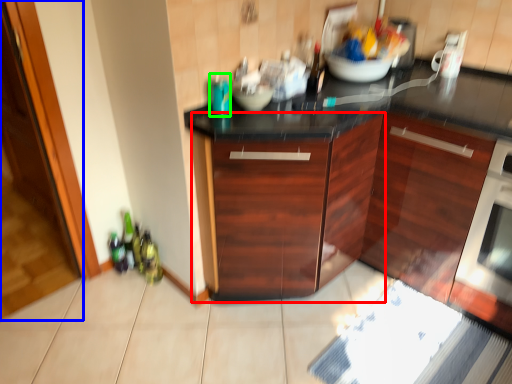
Question: Which object is the closest to the cabinetry (highlighted by a red box)? Choose among these: glass door (highlighted by a blue box) or bottle (highlighted by a green box).

Choices:
 (A) glass door
 (B) bottle

Answer: (B)